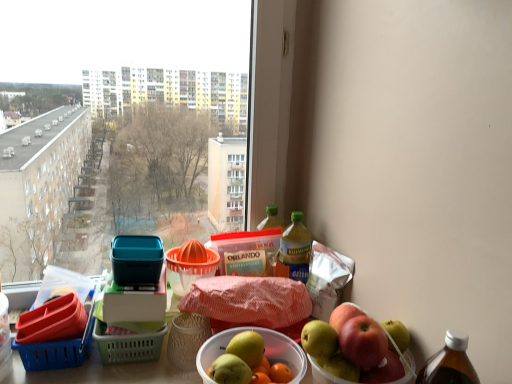
Question: In terms of height, does shiny red apple at right look taller or shorter compared to blue plastic basket at lower left, the second basket when ordered from top to bottom?

Choices:
 (A) tall
 (B) short

Answer: (A)

Question: From a real-world perspective, is shiny red apple at right above or below blue plastic basket at lower left, the second basket when ordered from top to bottom?

Choices:
 (A) above
 (B) below

Answer: (A)

Question: Estimate the real-world distances between objects in this image. Which object is farther from the yellow translucent bottle at upper right, the 2th bottle from the left?

Choices:
 (A) translucent plastic bottle at upper right, which ranks as the second bottle in right-to-left order
 (B) shiny red apple at right
 (C) orange plastic juicer at center, which ranks as the first basket in right-to-left order
 (D) blue plastic basket at lower left, the 1th basket when ordered from left to right

Answer: (D)

Question: Estimate the real-world distances between objects in this image. Which object is closer to the shiny red apple at right?

Choices:
 (A) yellow translucent bottle at upper right, arranged as the first bottle when viewed from the right
 (B) blue plastic basket at lower left, which is the first basket from bottom to top
 (C) orange plastic juicer at center, the 1th basket viewed from the top
 (D) translucent plastic bottle at upper right, which ranks as the second bottle in right-to-left order

Answer: (A)